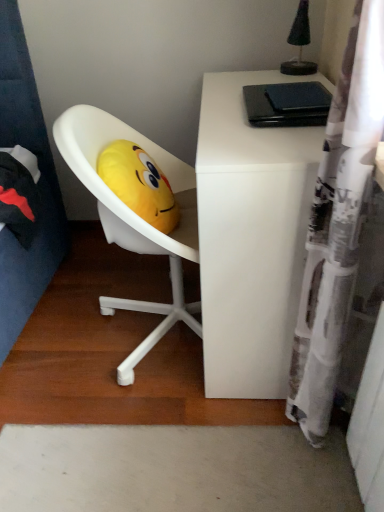
Describe the element at coordinates (251, 236) in the screenshot. I see `white matte desk at upper right` at that location.

Locate an element on the screen. white printed fabric shower curtain at right is located at coordinates (338, 221).

The image size is (384, 512). Find the location of `toy above the white matte desk at upper right (from the image's perspective)`. toy above the white matte desk at upper right (from the image's perspective) is located at coordinates (139, 184).

Considering the positions of objects white matte desk at upper right and yellow plush at center in the image provided, who is more to the right, white matte desk at upper right or yellow plush at center?

From the viewer's perspective, white matte desk at upper right appears more on the right side.

Does white matte desk at upper right have a lesser width compared to yellow plush at center?

In fact, white matte desk at upper right might be wider than yellow plush at center.

Considering the positions of objects white matte desk at upper right and yellow plush at center in the image provided, who is in front, white matte desk at upper right or yellow plush at center?

white matte desk at upper right is in front.

Which is more to the right, yellow plush at center or white printed fabric shower curtain at right?

From the viewer's perspective, white printed fabric shower curtain at right appears more on the right side.

You are a GUI agent. You are given a task and a screenshot of the screen. Output one action in this format:
    pyautogui.click(x=<x>, y=<y>)
    Task: Click on the shower curtain lying on the right of yellow plush at center
    The width and height of the screenshot is (384, 512).
    Given the screenshot: What is the action you would take?
    pyautogui.click(x=338, y=221)

How many degrees apart are the facing directions of yellow plush at center and white printed fabric shower curtain at right?

They differ by 178 degrees in their facing directions.

In terms of height, does yellow plush at center look taller or shorter compared to white printed fabric shower curtain at right?

Clearly, yellow plush at center is shorter compared to white printed fabric shower curtain at right.

From the image's perspective, would you say white matte desk at upper right is positioned over white printed fabric shower curtain at right?

Yes, from the image's perspective, white matte desk at upper right is over white printed fabric shower curtain at right.

Considering the positions of objects white matte desk at upper right and white printed fabric shower curtain at right in the image provided, who is in front, white matte desk at upper right or white printed fabric shower curtain at right?

white printed fabric shower curtain at right is more forward.

Are white matte desk at upper right and white printed fabric shower curtain at right far apart?

They are positioned close to each other.

Between white matte desk at upper right and white printed fabric shower curtain at right, which one has smaller size?

With smaller size is white printed fabric shower curtain at right.

Considering the relative positions of white printed fabric shower curtain at right and yellow plush at center in the image provided, is white printed fabric shower curtain at right to the right of yellow plush at center from the viewer's perspective?

Correct, you'll find white printed fabric shower curtain at right to the right of yellow plush at center.

From the image's perspective, is white printed fabric shower curtain at right below yellow plush at center?

Correct, white printed fabric shower curtain at right appears lower than yellow plush at center in the image.

Which is less distant, (x=323, y=324) or (x=158, y=181)?

The point (x=323, y=324) is in front.

Consider the image. Does white printed fabric shower curtain at right come behind yellow plush at center?

No, the depth of white printed fabric shower curtain at right is less than that of yellow plush at center.

From the picture: Which point is more distant from viewer, (169,231) or (260,221)?

The point (169,231) is more distant.

Is yellow plush at center closer to the viewer compared to white matte desk at upper right?

No.

Between yellow plush at center and white matte desk at upper right, which one appears on the right side from the viewer's perspective?

Positioned to the right is white matte desk at upper right.

From the image's perspective, which one is positioned higher, white printed fabric shower curtain at right or white matte desk at upper right?

white matte desk at upper right is shown above in the image.

Between white printed fabric shower curtain at right and white matte desk at upper right, which one is positioned behind?

white matte desk at upper right.

Which is in front, point (357, 157) or point (253, 194)?

Point (357, 157)

Can you confirm if white printed fabric shower curtain at right is taller than white matte desk at upper right?

Indeed, white printed fabric shower curtain at right has a greater height compared to white matte desk at upper right.

Locate an element on the screen. toy located behind the white matte desk at upper right is located at coordinates (139, 184).

Locate an element on the screen. This screenshot has height=512, width=384. shower curtain in front of the yellow plush at center is located at coordinates (338, 221).

When comparing their distances from white matte desk at upper right, does yellow plush at center or white printed fabric shower curtain at right seem closer?

white printed fabric shower curtain at right.

Looking at the image, which one is located closer to yellow plush at center, white matte desk at upper right or white printed fabric shower curtain at right?

white matte desk at upper right is positioned closer to the anchor yellow plush at center.

When comparing their distances from yellow plush at center, does white printed fabric shower curtain at right or white matte desk at upper right seem closer?

Based on the image, white matte desk at upper right appears to be nearer to yellow plush at center.

Considering their positions, is white printed fabric shower curtain at right positioned closer to white matte desk at upper right than yellow plush at center?

white printed fabric shower curtain at right is closer to white matte desk at upper right.

From the picture: Considering their positions, is white matte desk at upper right positioned closer to white printed fabric shower curtain at right than yellow plush at center?

white matte desk at upper right lies closer to white printed fabric shower curtain at right than the other object.

When comparing their distances from white printed fabric shower curtain at right, does yellow plush at center or white matte desk at upper right seem further?

yellow plush at center is positioned further to the anchor white printed fabric shower curtain at right.

Where is `desk between white printed fabric shower curtain at right and yellow plush at center in the front-back direction`? The width and height of the screenshot is (384, 512). desk between white printed fabric shower curtain at right and yellow plush at center in the front-back direction is located at coordinates (251, 236).